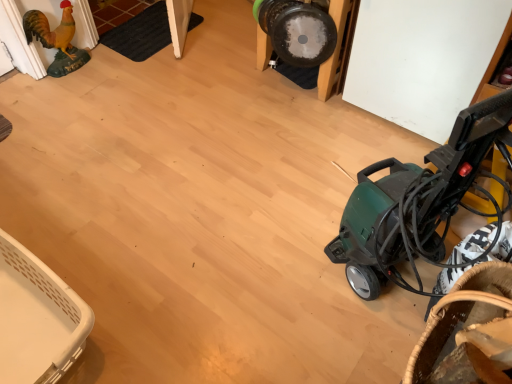
You are a GUI agent. You are given a task and a screenshot of the screen. Output one action in this format:
    pyautogui.click(x=<x>, y=<y>)
    Task: Click on the free area in between green plastic vacuum cleaner at right and white plastic basket at lower left, the second basket in the front-to-back sequence
    
    Given the screenshot: What is the action you would take?
    pyautogui.click(x=207, y=287)